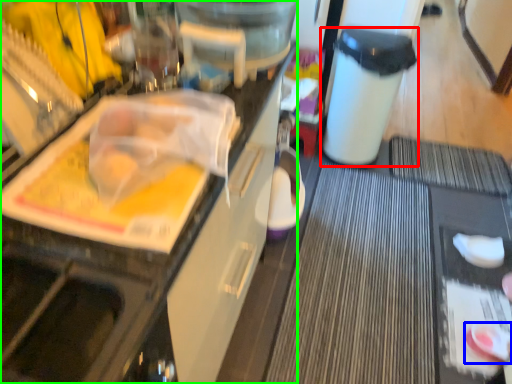
Question: Which object is positioned closest to trash bin/can (highlighted by a red box)? Select from food (highlighted by a blue box) and cabinetry (highlighted by a green box).

Choices:
 (A) food
 (B) cabinetry

Answer: (A)